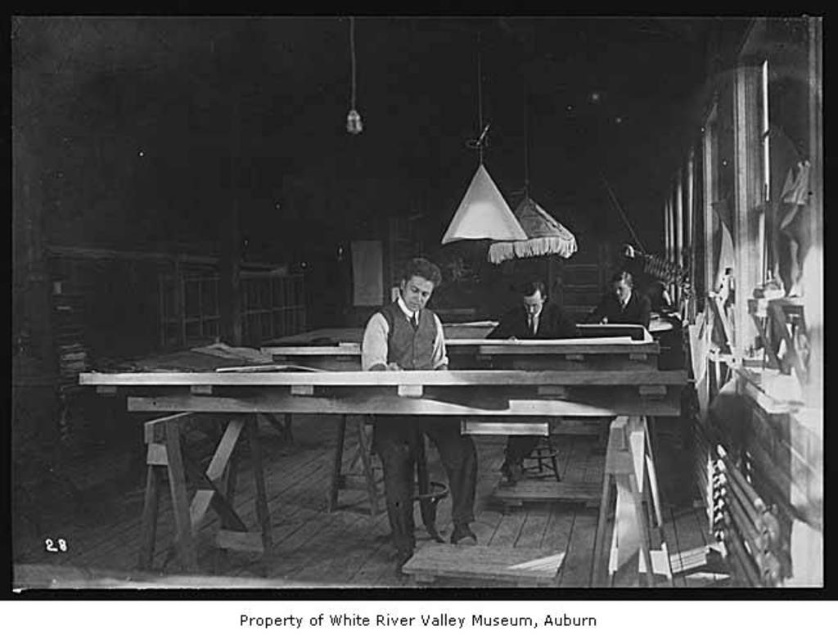
You are a visitor in this vintage office and need to place a 30 inch ruler on the wooden table at center and the smooth wood table at center. Can you fit the ruler on either table without it hanging off the edge?

The wooden table at center is 29.26 inches away from smooth wood table at center. The distance between them is less than the ruler length, so placing the ruler between them would not be possible. However, the question is about fitting on the tables themselves. Since the ruler is 30 inches long, and the tables are presumably at least that length, but the description does not provide table dimensions. Therefore, cannot determine from the given information.